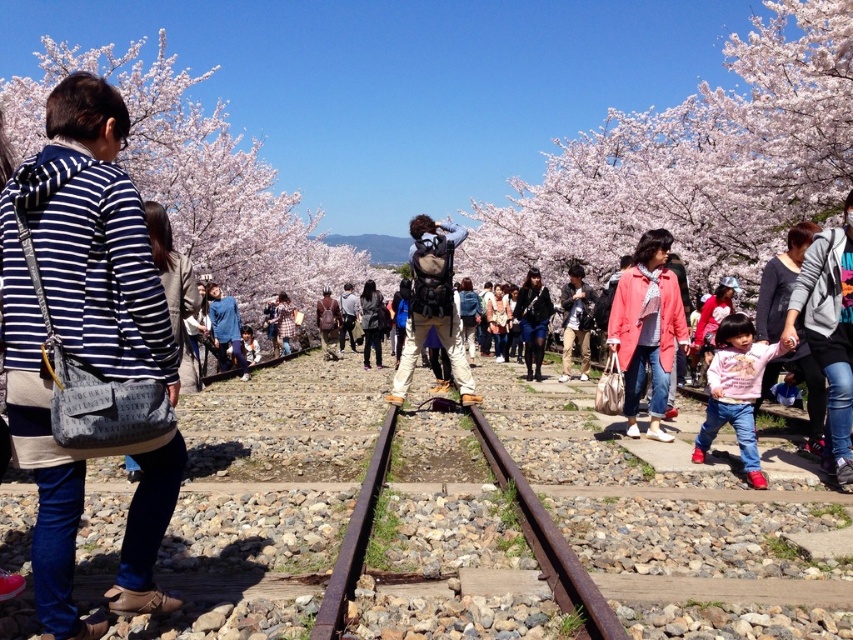
You are a photographer planning to capture a photo of the white blossoms at center and the striped cotton hoodie at left. Considering their sizes, which object should you focus on if you want to ensure both are clearly visible in the frame?

The white blossoms at center are larger than the striped cotton hoodie at left, so focusing on the white blossoms at center would allow both to be clearly visible since they occupy more space in the frame.

You are a photographer trying to capture both the pink fleece jacket at lower right and the pink cotton sweater at center in a single shot. Based on their positions, which one should you adjust your camera angle to focus on first to ensure both are in the frame?

Since the pink fleece jacket at lower right is to the left of the pink cotton sweater at center, you should adjust your camera angle to focus on the pink fleece jacket at lower right first to ensure both are included in the frame.

You are a photographer planning to take a photo of the striped cotton hoodie at left and the white blossoms at center. To ensure both are in the frame, should you position yourself to the left or right of the tracks?

You should position yourself to the right of the tracks because the white blossoms at center is to the right of the striped cotton hoodie at left, so placing yourself on the right side will keep both objects within your camera frame.